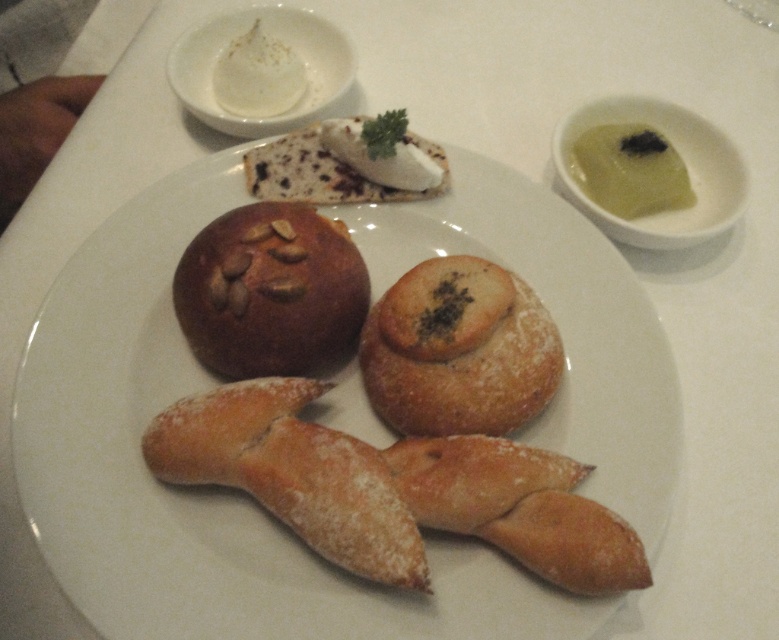
Question: Estimate the real-world distances between objects in this image. Which object is farther from the green creamy sauce at upper right?

Choices:
 (A) brown crusty bread at center
 (B) golden brown crusty bread at center
 (C) powdery golden-brown pastry at center
 (D) golden brown dough at center

Answer: (C)

Question: Is powdered sugar bread at center thinner than green creamy sauce at upper right?

Choices:
 (A) no
 (B) yes

Answer: (A)

Question: Can you confirm if powdered sugar bread at center is thinner than green creamy sauce at upper right?

Choices:
 (A) yes
 (B) no

Answer: (B)

Question: Based on their relative distances, which object is farther from the green creamy sauce at upper right?

Choices:
 (A) powdery golden-brown pastry at center
 (B) powdered sugar bread at center
 (C) golden brown dough at center
 (D) golden brown crusty bread at center

Answer: (A)

Question: Which of the following is the closest to the observer?

Choices:
 (A) brown crusty bread at center
 (B) golden brown dough at center
 (C) golden brown crusty bread at center
 (D) green creamy sauce at upper right

Answer: (B)

Question: Considering the relative positions of powdery golden-brown pastry at center and golden brown crusty bread at center in the image provided, where is powdery golden-brown pastry at center located with respect to golden brown crusty bread at center?

Choices:
 (A) right
 (B) left

Answer: (B)